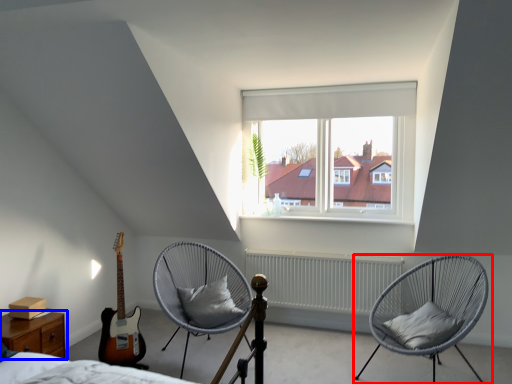
Question: Which object is further to the camera taking this photo, chair (highlighted by a red box) or nightstand (highlighted by a blue box)?

Choices:
 (A) chair
 (B) nightstand

Answer: (A)